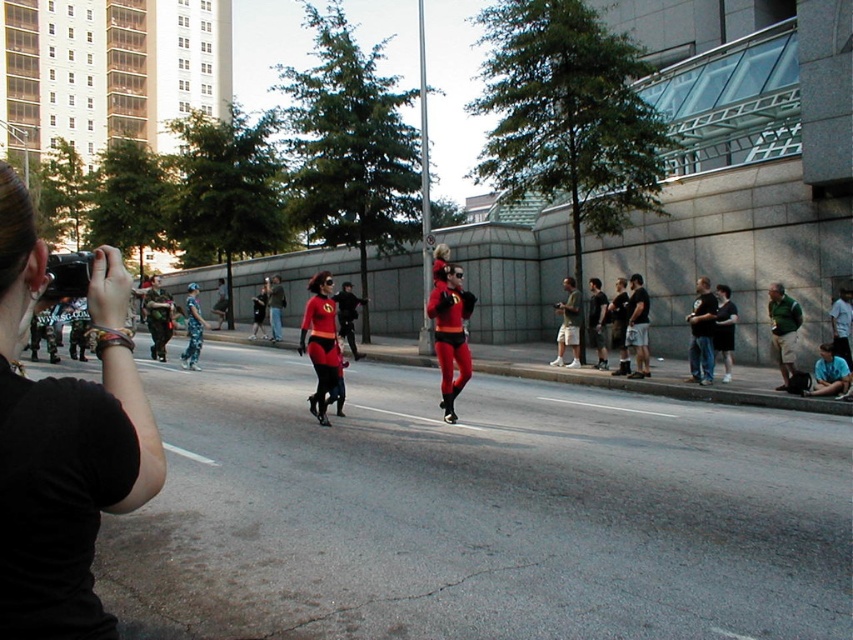
Is point (573, 336) positioned in front of point (607, 365)?

No, (573, 336) is further to viewer.

Who is lower down, matte black shorts at right or matte black shirt at center?

matte black shorts at right

Between point (573, 339) and point (601, 296), which one is positioned behind?

The point (601, 296) is behind.

Where is `matte black shorts at right`? This screenshot has height=640, width=853. matte black shorts at right is located at coordinates (567, 324).

Is black fabric camera at left positioned behind matte black shirt at center?

No.

Identify the location of black fabric camera at left. (62, 444).

Is matte black shirt at center wider than camouflage pants at center?

No, matte black shirt at center is not wider than camouflage pants at center.

Who is positioned more to the right, matte black shirt at center or camouflage pants at center?

matte black shirt at center is more to the right.

You are a GUI agent. You are given a task and a screenshot of the screen. Output one action in this format:
    pyautogui.click(x=<x>, y=<y>)
    Task: Click on the matte black shirt at center
    
    Given the screenshot: What is the action you would take?
    pyautogui.click(x=596, y=321)

Locate an element on the screen. The image size is (853, 640). matte black shirt at center is located at coordinates (596, 321).